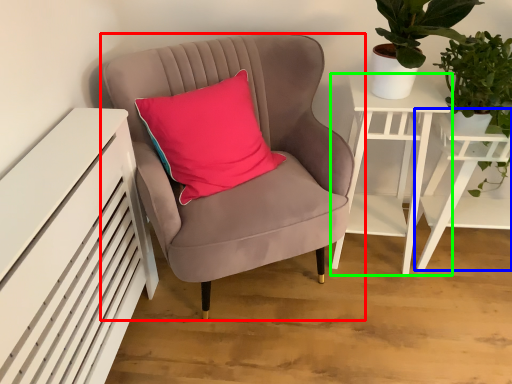
Question: Which is nearer to the chair (highlighted by a red box)? table (highlighted by a blue box) or nightstand (highlighted by a green box).

Choices:
 (A) table
 (B) nightstand

Answer: (B)